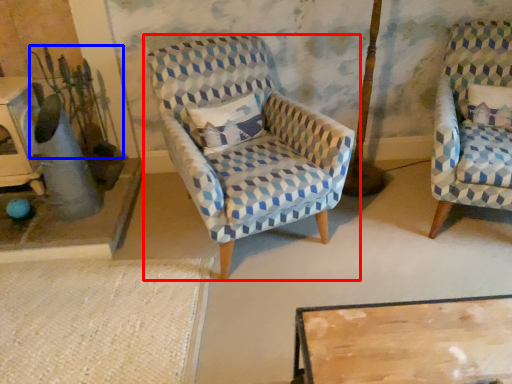
Question: Which object is further to the camera taking this photo, chair (highlighted by a red box) or plant (highlighted by a blue box)?

Choices:
 (A) chair
 (B) plant

Answer: (B)